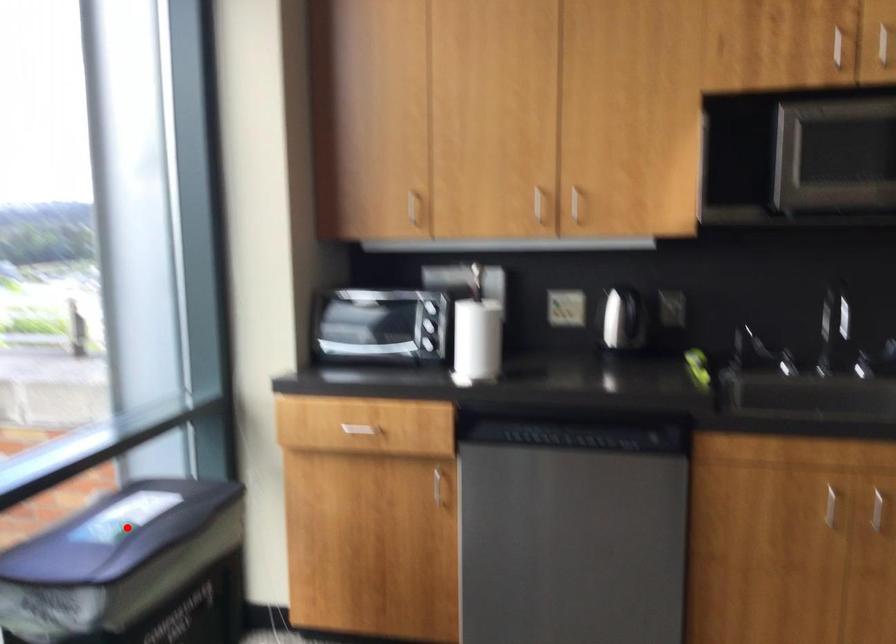
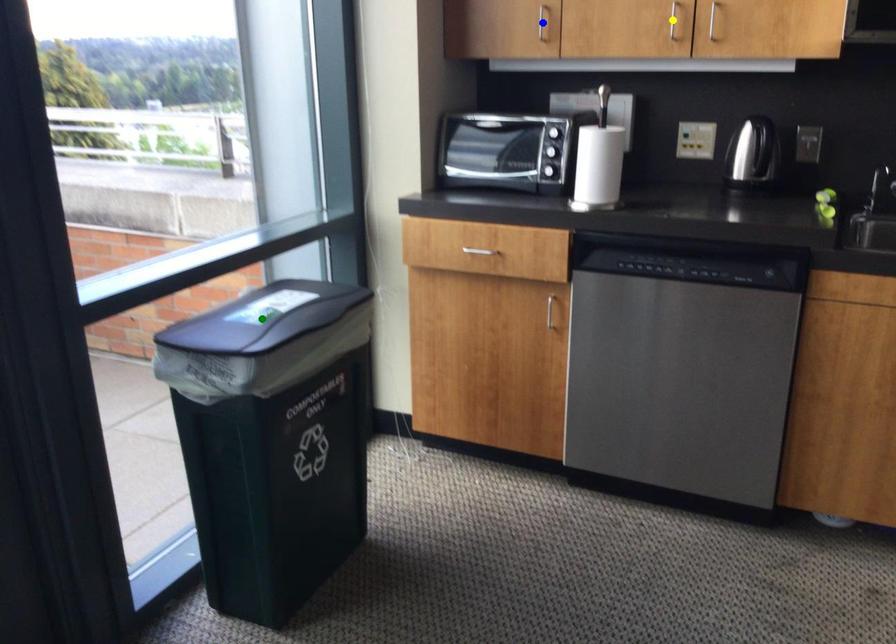
Question: I am providing you with two images of the same scene from different viewpoints. A red point is marked on the first image. You are given multiple points on the second image. Can you choose the point in image 2 that corresponds to the point in image 1?

Choices:
 (A) blue point
 (B) green point
 (C) yellow point

Answer: (B)